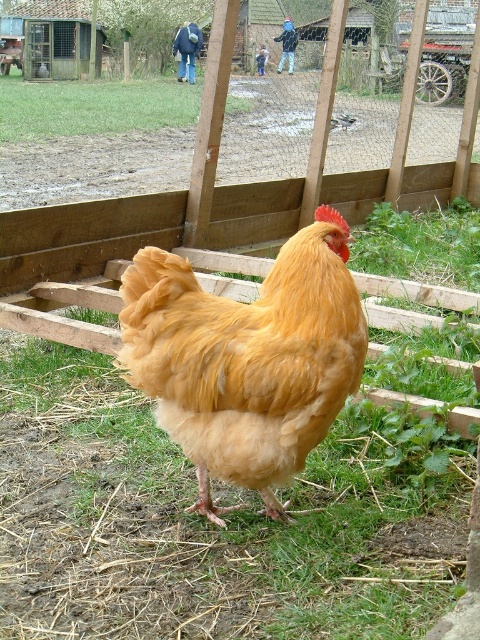
Question: Which of the following is the closest to the observer?

Choices:
 (A) (36, 116)
 (B) (228, 369)

Answer: (B)

Question: Which object appears farthest from the camera in this image?

Choices:
 (A) golden feathered rooster at center
 (B) green grass at center

Answer: (B)

Question: Is golden feathered rooster at center smaller than green grass at center?

Choices:
 (A) no
 (B) yes

Answer: (B)

Question: Does golden feathered rooster at center have a larger size compared to green grass at center?

Choices:
 (A) yes
 (B) no

Answer: (B)

Question: Which point appears farthest from the camera in this image?

Choices:
 (A) (336, 403)
 (B) (86, 120)

Answer: (B)

Question: Does golden feathered rooster at center lie in front of green grass at center?

Choices:
 (A) no
 (B) yes

Answer: (B)